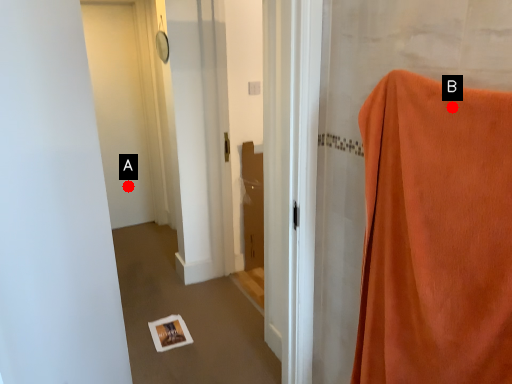
Question: Two points are circled on the image, labeled by A and B beside each circle. Which point is closer to the camera?

Choices:
 (A) A is closer
 (B) B is closer

Answer: (B)